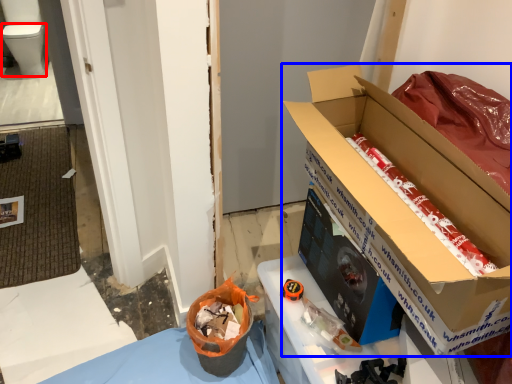
Question: Which object appears farthest to the camera in this image, toilet bowl (highlighted by a red box) or box (highlighted by a blue box)?

Choices:
 (A) toilet bowl
 (B) box

Answer: (A)